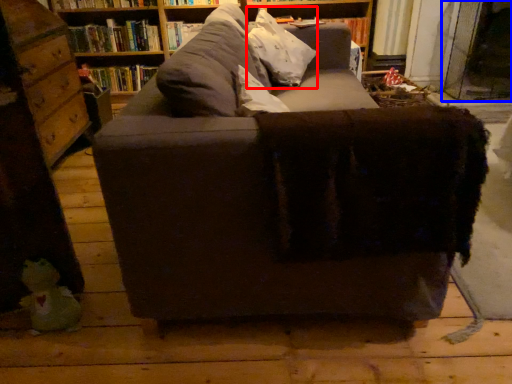
Question: Among these objects, which one is farthest to the camera, throw pillow (highlighted by a red box) or glass door (highlighted by a blue box)?

Choices:
 (A) throw pillow
 (B) glass door

Answer: (B)